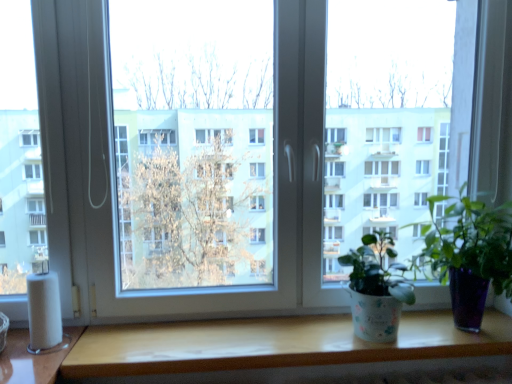
Question: Does point (55, 279) appear closer or farther from the camera than point (481, 218)?

Choices:
 (A) closer
 (B) farther

Answer: (A)

Question: Looking at the image, does white matte toilet paper at lower left seem bigger or smaller compared to green glossy plant at center, positioned as the 1th houseplant in right-to-left order?

Choices:
 (A) big
 (B) small

Answer: (B)

Question: Which is farther from the green glossy plant at center, which is the second houseplant in left-to-right order?

Choices:
 (A) wooden table at lower center
 (B) white textured pot at center, the 2th houseplant from the right
 (C) white matte toilet paper at lower left

Answer: (C)

Question: Which object is the farthest from the white matte toilet paper at lower left?

Choices:
 (A) wooden table at lower center
 (B) green glossy plant at center, positioned as the 1th houseplant in right-to-left order
 (C) white textured pot at center, which ranks as the first houseplant in left-to-right order

Answer: (B)